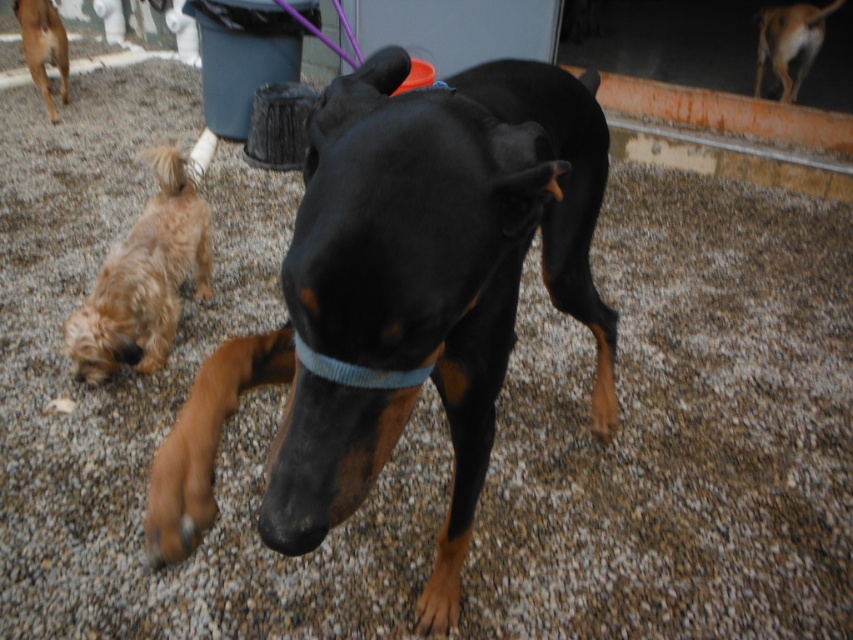
You are a photographer trying to capture a group photo of the fuzzy brown dog at lower left and the brown fur dog at upper left. To ensure both are in frame, where should you position yourself relative to the dogs?

You should position yourself to the left of the dogs so that both the fuzzy brown dog at lower left and the brown fur dog at upper left can be captured in the frame, as the fuzzy brown dog at lower left is on the right side of the brown fur dog at upper left.

You are a dog owner who wants to call both the fuzzy brown dog at lower left and the brown fur dog at upper left to come to you. Since you can only call one at a time, which dog should you call first to minimize the total distance they have to walk to reach you?

You should call the fuzzy brown dog at lower left first because it is closer to you than the brown fur dog at upper left. The fuzzy brown dog at lower left is only 8.58 feet away from the brown fur dog at upper left, so it would have a shorter distance to travel.

You are a dog owner trying to locate your two dogs in the park. You see the fuzzy brown dog at lower left and the brown fur dog at upper right. Which one is closer to you?

The fuzzy brown dog at lower left is closer to you because it is in front of the brown fur dog at upper right.